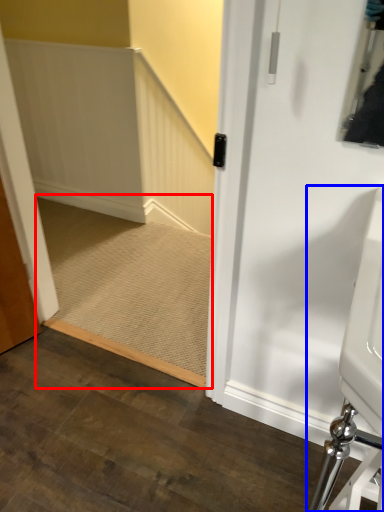
Question: Among these objects, which one is farthest to the camera, stairs (highlighted by a red box) or sink (highlighted by a blue box)?

Choices:
 (A) stairs
 (B) sink

Answer: (A)